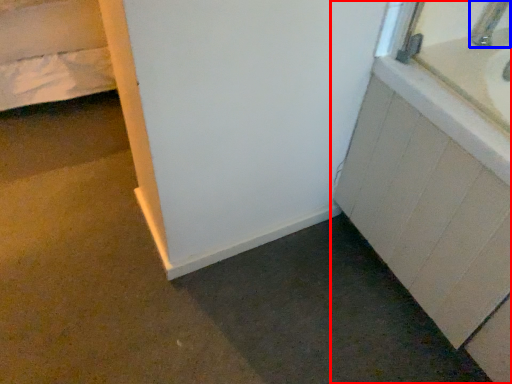
Question: Which of the following is the farthest to the observer, bathroom cabinet (highlighted by a red box) or faucet (highlighted by a blue box)?

Choices:
 (A) bathroom cabinet
 (B) faucet

Answer: (B)